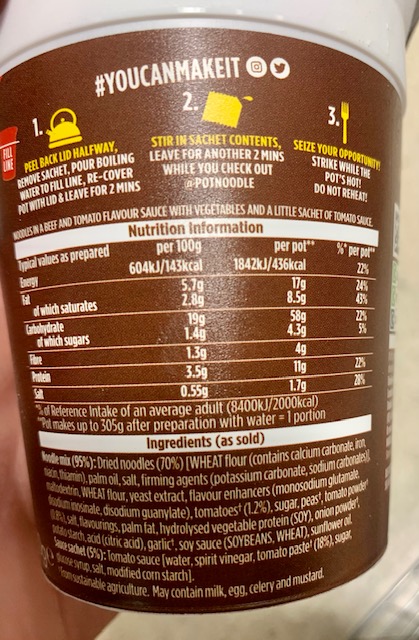
Locate an element on the screen. fork is located at coordinates pyautogui.click(x=345, y=114).